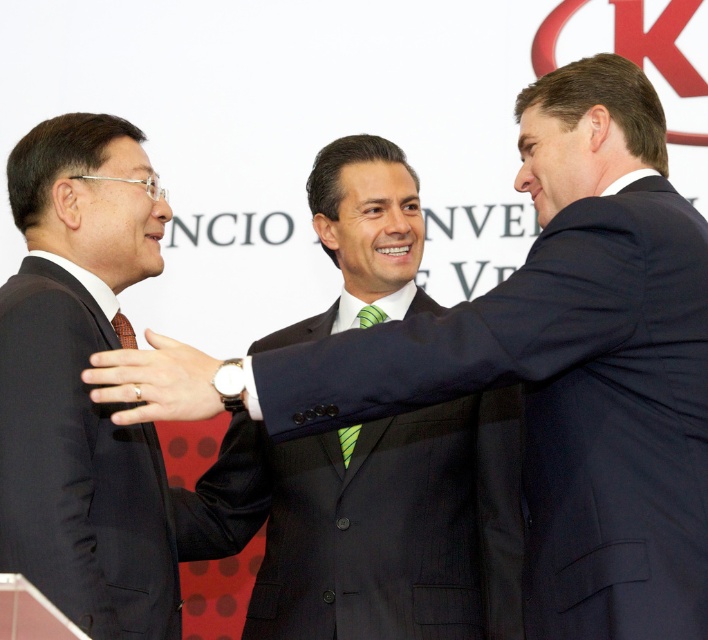
Question: Which point is farther to the camera?

Choices:
 (A) click(x=348, y=452)
 (B) click(x=131, y=326)

Answer: (A)

Question: Does gold metallic ring at center appear over greenmaterial/texturetie at center?

Choices:
 (A) no
 (B) yes

Answer: (A)

Question: Does gold metallic ring at center lie in front of greenmaterial/texturetie at center?

Choices:
 (A) yes
 (B) no

Answer: (A)

Question: Which object is closer to the camera taking this photo?

Choices:
 (A) greenmaterial/texturetie at center
 (B) black matte suit at left
 (C) gold metallic ring at center

Answer: (C)

Question: Which object is positioned farthest from the black pinstripe suit at center?

Choices:
 (A) black matte suit at left
 (B) greenmaterial/texturetie at center

Answer: (A)

Question: Is black matte suit at left to the right of black pinstripe suit at center from the viewer's perspective?

Choices:
 (A) no
 (B) yes

Answer: (A)